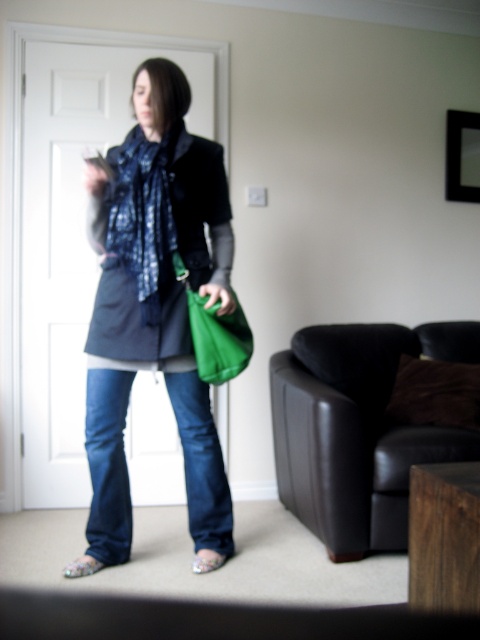
Question: Is green leather bag at lower center to the right of floral fabric sandal at lower center from the viewer's perspective?

Choices:
 (A) yes
 (B) no

Answer: (A)

Question: Which point is farther to the camera?

Choices:
 (A) blue printed fabric scarf at center
 (B) floral fabric sandal at lower center
 (C) green leather bag at lower center
 (D) floral fabric sandal at lower left

Answer: (B)

Question: Is matte black jacket at center smaller than black leather armchair at center right?

Choices:
 (A) yes
 (B) no

Answer: (A)

Question: Which point is farther to the camera?

Choices:
 (A) black leather armchair at center right
 (B) floral fabric sandal at lower left

Answer: (A)

Question: Can you confirm if matte black jacket at center is positioned to the left of blue printed fabric scarf at center?

Choices:
 (A) no
 (B) yes

Answer: (A)

Question: Among these points, which one is farthest from the camera?

Choices:
 (A) (191, 200)
 (B) (369, 436)
 (C) (91, 570)
 (D) (149, 268)

Answer: (B)